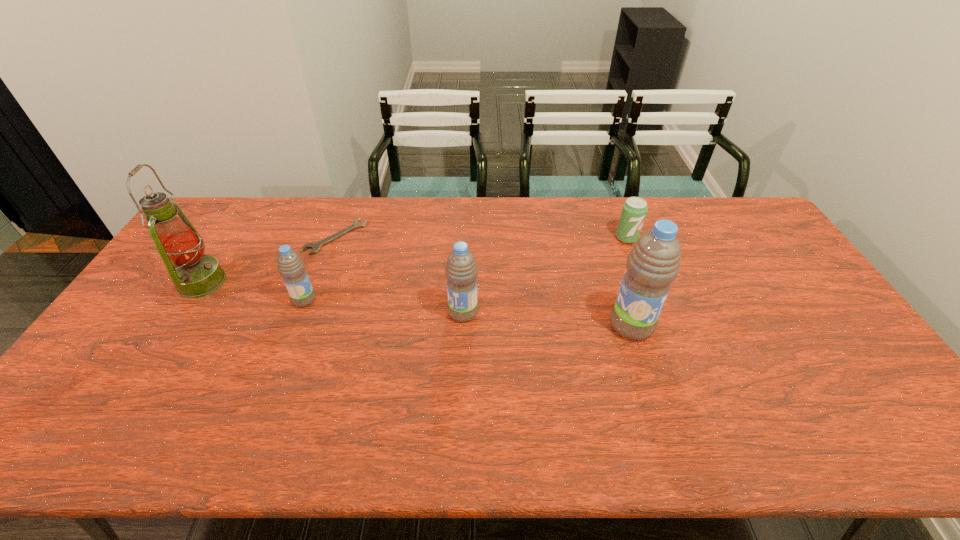
In the image, there is a desktop. Identify the location of free region at the near right corner. (878, 397).

In order to click on free spot between the leftmost object and the shortest object in this screenshot , I will do `click(269, 260)`.

You are a GUI agent. You are given a task and a screenshot of the screen. Output one action in this format:
    pyautogui.click(x=<x>, y=<y>)
    Task: Click on the unoccupied area between the shortest object and the leftmost object
    
    Given the screenshot: What is the action you would take?
    pyautogui.click(x=269, y=260)

The width and height of the screenshot is (960, 540). What are the coordinates of `vacant space that is in between the oil lamp and the soda` in the screenshot? It's located at (415, 260).

The image size is (960, 540). What are the coordinates of `free spot between the rightmost water bottle and the shortest object` in the screenshot? It's located at (484, 281).

At what (x,y) coordinates should I click in order to perform the action: click on unoccupied position between the fourth tallest object and the wrench. Please return your answer as a coordinate pair (x, y). Image resolution: width=960 pixels, height=540 pixels. Looking at the image, I should click on (320, 268).

Locate an element on the screen. The image size is (960, 540). unoccupied area between the second shortest water bottle and the wrench is located at coordinates (399, 275).

You are a GUI agent. You are given a task and a screenshot of the screen. Output one action in this format:
    pyautogui.click(x=<x>, y=<y>)
    Task: Click on the free space between the third object from right to left and the shortest object
    
    Given the screenshot: What is the action you would take?
    [399, 275]

Locate which object is the fifth closest to the soda. Please provide its 2D coordinates. Your answer should be formatted as a tuple, i.e. [(x, y)], where the tuple contains the x and y coordinates of a point satisfying the conditions above.

[(195, 275)]

This screenshot has height=540, width=960. I want to click on the closest object to the fourth tallest object, so click(x=315, y=246).